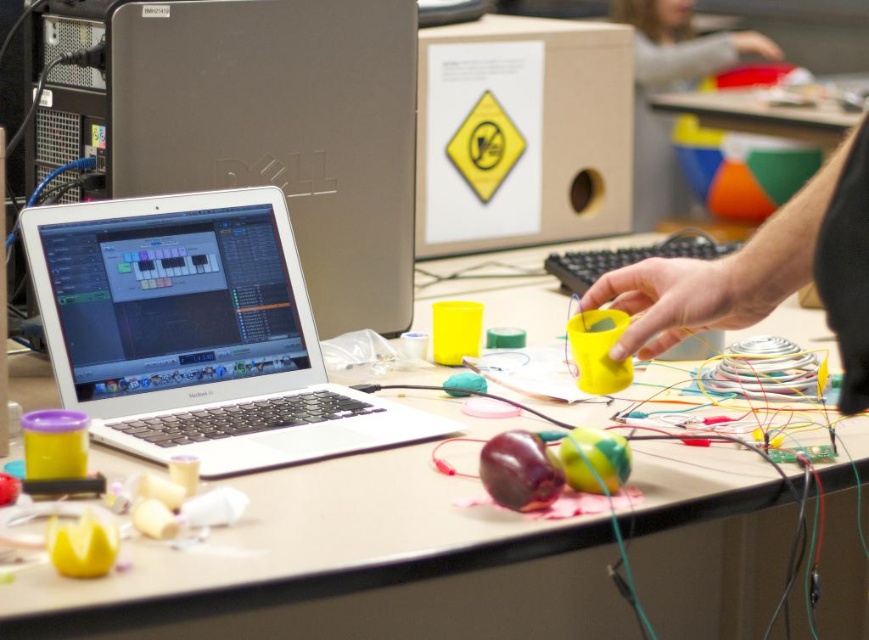
Question: Based on their relative distances, which object is farther from the shiny purple plastic toy at center?

Choices:
 (A) rubberized green ball at center
 (B) smooth plastic ball at upper right
 (C) yellow matte cup at center right

Answer: (B)

Question: Which of the following is the closest to the observer?

Choices:
 (A) matte plastic table at center
 (B) yellow matte cup at center
 (C) smooth plastic ball at upper right
 (D) shiny purple plastic toy at center

Answer: (A)

Question: Does smooth plastic ball at upper right appear under yellow matte cup at center?

Choices:
 (A) no
 (B) yes

Answer: (A)

Question: Which object appears closest to the camera in this image?

Choices:
 (A) yellow matte cup at center right
 (B) smooth plastic ball at upper right
 (C) rubberized green ball at center
 (D) yellow matte cup at center

Answer: (A)

Question: Is white matte laptop at center positioned before rubberized green ball at center?

Choices:
 (A) no
 (B) yes

Answer: (A)

Question: Does silver metallic laptop at upper left have a greater width compared to yellow matte cup at center right?

Choices:
 (A) no
 (B) yes

Answer: (B)